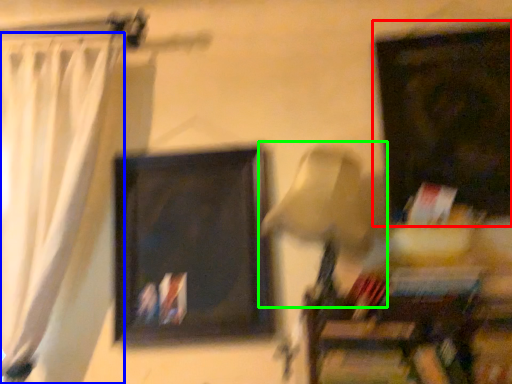
Question: Considering the real-world distances, which object is closest to picture frame (highlighted by a red box)? curtain (highlighted by a blue box) or table lamp (highlighted by a green box).

Choices:
 (A) curtain
 (B) table lamp

Answer: (B)